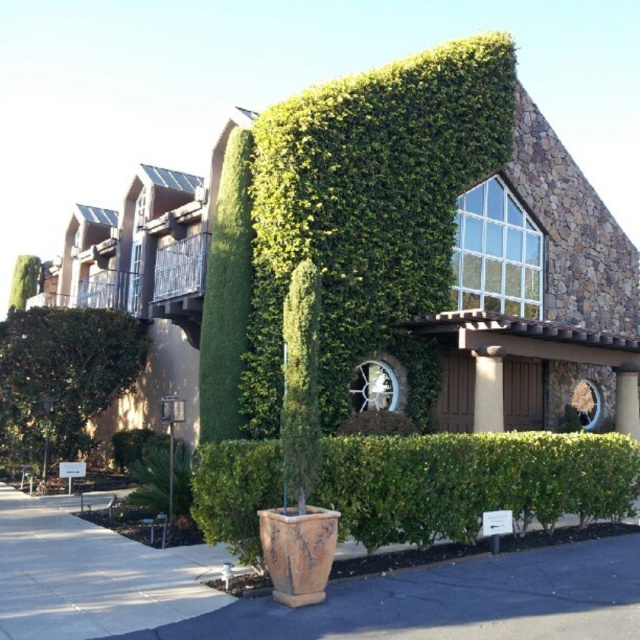
Can you confirm if green leafy hedge at lower center is positioned above green leafy bush at lower left?

Actually, green leafy hedge at lower center is below green leafy bush at lower left.

Who is higher up, green leafy hedge at lower center or green leafy bush at lower left?

green leafy bush at lower left is above.

The image size is (640, 640). Describe the element at coordinates (472, 483) in the screenshot. I see `green leafy hedge at lower center` at that location.

Find the location of a particular element. green leafy hedge at lower center is located at coordinates (472, 483).